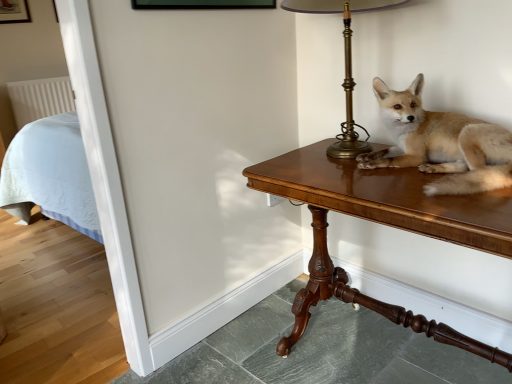
Question: From a real-world perspective, is wooden table at right physically above brass lampshade at upper right?

Choices:
 (A) no
 (B) yes

Answer: (A)

Question: Does wooden table at right have a smaller size compared to brass lampshade at upper right?

Choices:
 (A) no
 (B) yes

Answer: (A)

Question: Does wooden table at right have a greater height compared to brass lampshade at upper right?

Choices:
 (A) no
 (B) yes

Answer: (B)

Question: Is wooden table at right further to camera compared to brass lampshade at upper right?

Choices:
 (A) no
 (B) yes

Answer: (A)

Question: Considering the relative positions of wooden table at right and brass lampshade at upper right in the image provided, is wooden table at right in front of brass lampshade at upper right?

Choices:
 (A) yes
 (B) no

Answer: (A)

Question: Relative to wooden table at right, is brass lampshade at upper right in front or behind?

Choices:
 (A) front
 (B) behind

Answer: (B)

Question: Based on their positions, is brass lampshade at upper right located to the left or right of wooden table at right?

Choices:
 (A) right
 (B) left

Answer: (B)

Question: Is brass lampshade at upper right taller or shorter than wooden table at right?

Choices:
 (A) tall
 (B) short

Answer: (B)

Question: From the image's perspective, is brass lampshade at upper right located above or below wooden table at right?

Choices:
 (A) below
 (B) above

Answer: (B)

Question: Is point (484, 125) positioned closer to the camera than point (358, 142)?

Choices:
 (A) farther
 (B) closer

Answer: (B)

Question: In the image, is light brown fur at center positioned in front of or behind brass lampshade at upper right?

Choices:
 (A) front
 (B) behind

Answer: (A)

Question: From their relative heights in the image, would you say light brown fur at center is taller or shorter than brass lampshade at upper right?

Choices:
 (A) short
 (B) tall

Answer: (A)

Question: From a real-world perspective, relative to brass lampshade at upper right, is light brown fur at center vertically above or below?

Choices:
 (A) above
 (B) below

Answer: (B)

Question: Is brass lampshade at upper right to the left or to the right of light brown fur at center in the image?

Choices:
 (A) right
 (B) left

Answer: (B)

Question: From a real-world perspective, relative to light brown fur at center, is brass lampshade at upper right vertically above or below?

Choices:
 (A) below
 (B) above

Answer: (B)